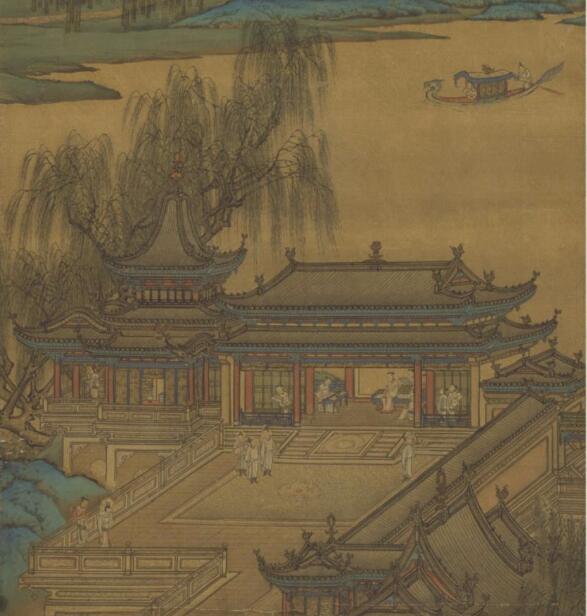
This screenshot has width=587, height=616. Identify the location of furniture legs. (323, 408), (332, 408), (337, 400), (346, 400).